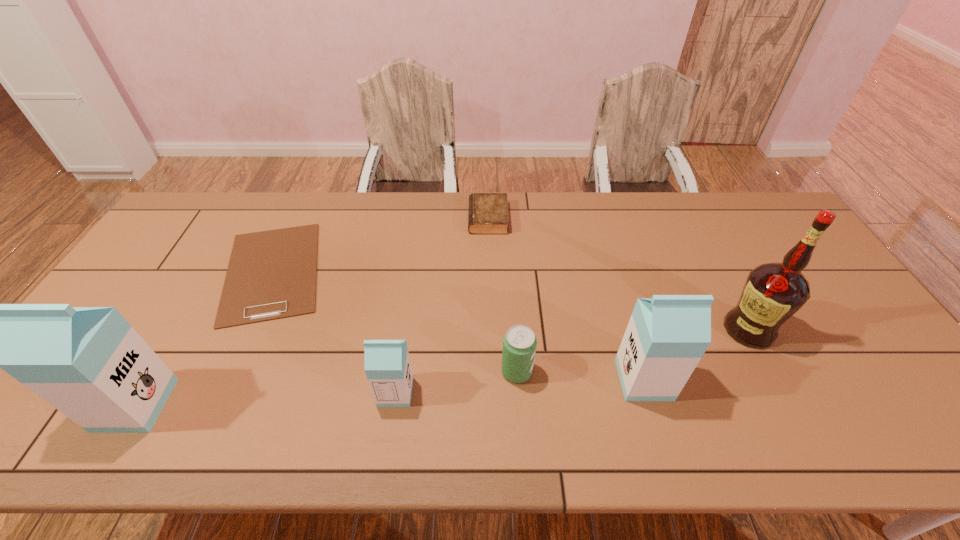
You are a GUI agent. You are given a task and a screenshot of the screen. Output one action in this format:
    pyautogui.click(x=<x>, y=<y>)
    Task: Click on the free space between the diary and the clipboard
    
    Given the screenshot: What is the action you would take?
    pyautogui.click(x=380, y=245)

Identify the location of free space between the second shortest object and the soda. (502, 295).

You are a GUI agent. You are given a task and a screenshot of the screen. Output one action in this format:
    pyautogui.click(x=<x>, y=<y>)
    Task: Click on the empty space that is in between the soda and the third tallest object
    The width and height of the screenshot is (960, 540).
    Given the screenshot: What is the action you would take?
    pyautogui.click(x=581, y=375)

Where is `free space between the rightmost object and the third object from left to right`? The height and width of the screenshot is (540, 960). free space between the rightmost object and the third object from left to right is located at coordinates (572, 361).

This screenshot has width=960, height=540. Find the location of `free space between the third shortest object and the sixth tallest object`. free space between the third shortest object and the sixth tallest object is located at coordinates (502, 295).

Where is `unoccupied position between the rightmost milk carton and the clipboard`? unoccupied position between the rightmost milk carton and the clipboard is located at coordinates (458, 326).

Locate an element on the screen. object that is the sixth closest one to the leftmost milk carton is located at coordinates (773, 292).

The width and height of the screenshot is (960, 540). I want to click on object that stands as the fifth closest to the fifth shortest object, so click(x=272, y=274).

Select which milk carton appears as the second closest to the diary. Please provide its 2D coordinates. Your answer should be formatted as a tuple, i.e. [(x, y)], where the tuple contains the x and y coordinates of a point satisfying the conditions above.

[(387, 365)]

What are the coordinates of `milk carton that is the third closest to the clipboard` in the screenshot? It's located at (667, 335).